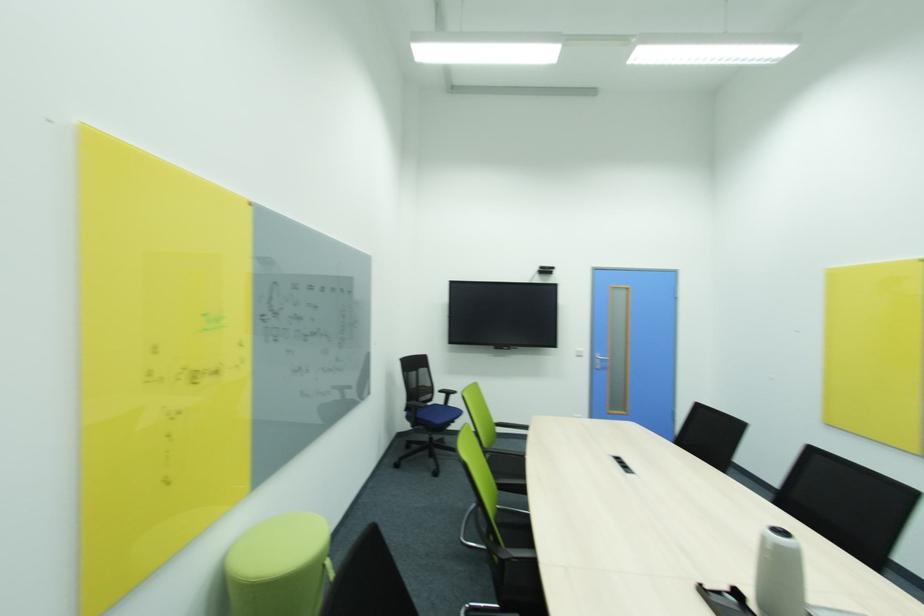
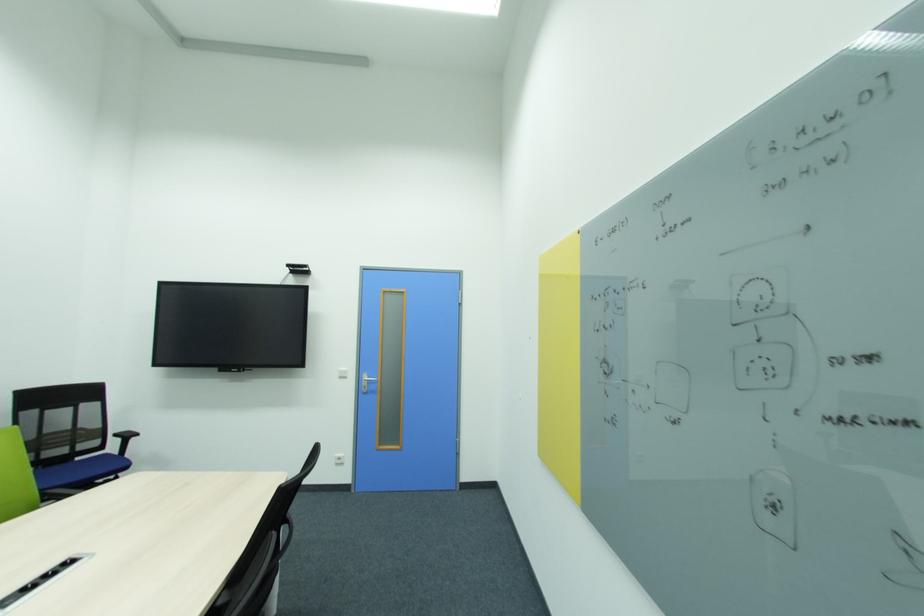
Question: I am providing you with two images of the same scene from different viewpoints. Which of the following objects are not visible in image2?

Choices:
 (A) white light switch
 (B) green chair sitting surface
 (C) crumpled paper envelope
 (D) silver door handle

Answer: (B)